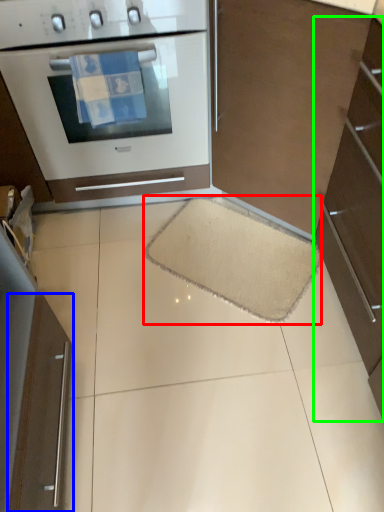
Question: Estimate the real-world distances between objects in this image. Which object is farther from doormat (highlighted by a red box), appliance (highlighted by a blue box) or cabinetry (highlighted by a green box)?

Choices:
 (A) appliance
 (B) cabinetry

Answer: (A)